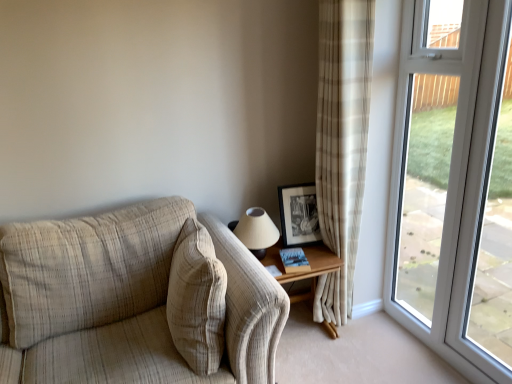
Question: Does transparent glass window at right have a lesser height compared to wooden table at right?

Choices:
 (A) yes
 (B) no

Answer: (B)

Question: Does transparent glass window at right appear on the right side of wooden table at right?

Choices:
 (A) no
 (B) yes

Answer: (B)

Question: Is transparent glass window at right oriented towards wooden table at right?

Choices:
 (A) yes
 (B) no

Answer: (A)

Question: Is transparent glass window at right positioned with its back to wooden table at right?

Choices:
 (A) no
 (B) yes

Answer: (A)

Question: From the image's perspective, would you say transparent glass window at right is shown under wooden table at right?

Choices:
 (A) yes
 (B) no

Answer: (B)

Question: Is hardcover book at lower right spatially inside black matte picture frame at upper right, or outside of it?

Choices:
 (A) inside
 (B) outside

Answer: (B)

Question: From a real-world perspective, is hardcover book at lower right physically located above or below black matte picture frame at upper right?

Choices:
 (A) below
 (B) above

Answer: (A)

Question: In the image, is hardcover book at lower right on the left side or the right side of black matte picture frame at upper right?

Choices:
 (A) left
 (B) right

Answer: (A)

Question: Is hardcover book at lower right wider or thinner than black matte picture frame at upper right?

Choices:
 (A) wide
 (B) thin

Answer: (A)

Question: Considering the relative positions of wooden table at right and transparent glass window at right in the image provided, is wooden table at right to the left or to the right of transparent glass window at right?

Choices:
 (A) right
 (B) left

Answer: (B)

Question: Looking at the image, does wooden table at right seem bigger or smaller compared to transparent glass window at right?

Choices:
 (A) small
 (B) big

Answer: (B)

Question: From a real-world perspective, relative to transparent glass window at right, is wooden table at right vertically above or below?

Choices:
 (A) above
 (B) below

Answer: (B)

Question: From the image's perspective, is wooden table at right located above or below transparent glass window at right?

Choices:
 (A) above
 (B) below

Answer: (B)

Question: Is wooden table at right situated inside transparent glass screen door at right or outside?

Choices:
 (A) inside
 (B) outside

Answer: (B)

Question: From a real-world perspective, is wooden table at right above or below transparent glass screen door at right?

Choices:
 (A) above
 (B) below

Answer: (B)